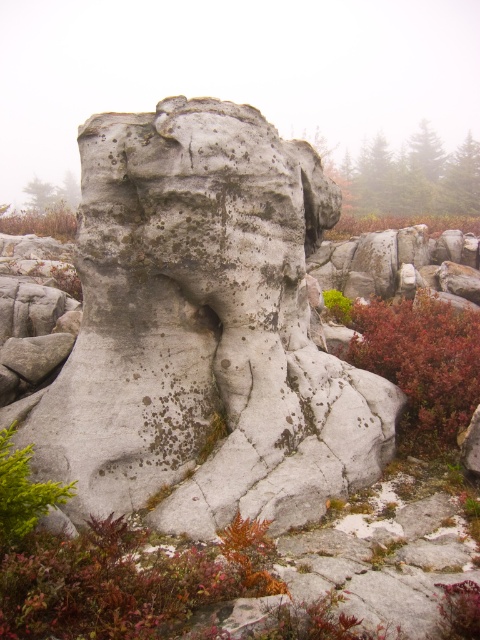
You are a geologist studying rock formations. You observe the gray rough rock at center in the image. Based on its location coordinates, can you determine if it is positioned closer to the top or bottom of the image?

The gray rough rock at center is located at point coordinates where the y value is 0.425. Since the coordinate system typically places 0 at the bottom and 1 at the top, a y value of 0.425 places it closer to the bottom of the image.

You are a botanist studying the leathery red shrub at center right. Based on its position in the image, can you determine its exact coordinates?

The leathery red shrub at center right is located at point (421,364).